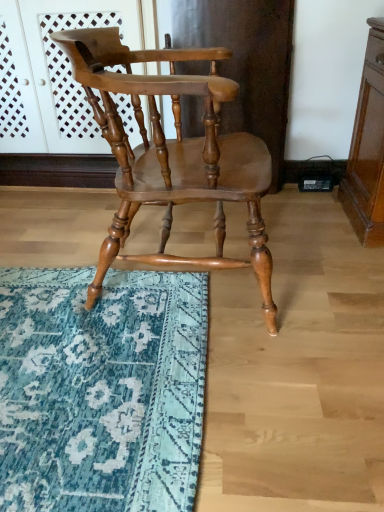
The image size is (384, 512). What do you see at coordinates (173, 153) in the screenshot?
I see `shiny brown wood chair at center` at bounding box center [173, 153].

Locate an element on the screen. Image resolution: width=384 pixels, height=512 pixels. shiny brown wood chair at center is located at coordinates (173, 153).

Is matte wood screen door at upper center surrounded by teal rug at lower left?

Definitely not — matte wood screen door at upper center is not inside teal rug at lower left.

Measure the distance from teal rug at lower left to matte wood screen door at upper center.

They are 3.89 feet apart.

Considering the sizes of teal rug at lower left and matte wood screen door at upper center in the image, is teal rug at lower left taller or shorter than matte wood screen door at upper center?

In the image, teal rug at lower left appears to be shorter than matte wood screen door at upper center.

From the image's perspective, is teal rug at lower left over shiny brown wood chair at center?

No, from the image's perspective, teal rug at lower left is not over shiny brown wood chair at center.

Would you say teal rug at lower left is to the left or to the right of shiny brown wood chair at center in the picture?

Clearly, teal rug at lower left is on the left of shiny brown wood chair at center in the image.

Between teal rug at lower left and shiny brown wood chair at center, which one has smaller size?

Smaller between the two is teal rug at lower left.

Considering the sizes of objects teal rug at lower left and shiny brown wood chair at center in the image provided, who is shorter, teal rug at lower left or shiny brown wood chair at center?

Standing shorter between the two is teal rug at lower left.

Which object is further away from the camera taking this photo, shiny brown wood chair at center or teal rug at lower left?

teal rug at lower left.

Are shiny brown wood chair at center and teal rug at lower left making contact?

No, shiny brown wood chair at center is not touching teal rug at lower left.

From a real-world perspective, is shiny brown wood chair at center positioned under teal rug at lower left based on gravity?

No.

How many degrees apart are the facing directions of shiny brown wood chair at center and teal rug at lower left?

179 degrees separate the facing orientations of shiny brown wood chair at center and teal rug at lower left.

From a real-world perspective, is matte wood screen door at upper center located beneath teal rug at lower left?

No, from a real-world perspective, matte wood screen door at upper center is not beneath teal rug at lower left.

Locate an element on the screen. The image size is (384, 512). screen door that appears above the teal rug at lower left (from the image's perspective) is located at coordinates (52, 73).

Who is shorter, matte wood screen door at upper center or teal rug at lower left?

With less height is teal rug at lower left.

Which is more distant, (50, 136) or (206, 185)?

Positioned behind is point (50, 136).

Identify the location of chair located underneath the matte wood screen door at upper center (from a real-world perspective). The width and height of the screenshot is (384, 512). (173, 153).

Are matte wood screen door at upper center and shiny brown wood chair at center far apart?

No, there isn't a large distance between matte wood screen door at upper center and shiny brown wood chair at center.

Is matte wood screen door at upper center oriented towards shiny brown wood chair at center?

Yes, matte wood screen door at upper center is aimed at shiny brown wood chair at center.

Are shiny brown wood chair at center and matte wood screen door at upper center far apart?

No, shiny brown wood chair at center is not far away from matte wood screen door at upper center.

Measure the distance from shiny brown wood chair at center to matte wood screen door at upper center.

shiny brown wood chair at center is 32.58 inches away from matte wood screen door at upper center.

From a real-world perspective, between shiny brown wood chair at center and matte wood screen door at upper center, who is vertically higher?

matte wood screen door at upper center is physically above.

From the image's perspective, is shiny brown wood chair at center located above or below matte wood screen door at upper center?

From the image's perspective, shiny brown wood chair at center appears below matte wood screen door at upper center.

Where is `screen door on the left of teal rug at lower left`? Image resolution: width=384 pixels, height=512 pixels. screen door on the left of teal rug at lower left is located at coordinates (52, 73).

Locate an element on the screen. chair to the right of teal rug at lower left is located at coordinates (173, 153).

In the scene shown: When comparing their distances from matte wood screen door at upper center, does teal rug at lower left or shiny brown wood chair at center seem closer?

The object closer to matte wood screen door at upper center is shiny brown wood chair at center.

When comparing their distances from shiny brown wood chair at center, does matte wood screen door at upper center or teal rug at lower left seem closer?

teal rug at lower left lies closer to shiny brown wood chair at center than the other object.

Looking at the image, which one is located further to teal rug at lower left, matte wood screen door at upper center or shiny brown wood chair at center?

The object further to teal rug at lower left is matte wood screen door at upper center.

Based on the photo, considering their positions, is shiny brown wood chair at center positioned further to matte wood screen door at upper center than teal rug at lower left?

Among the two, teal rug at lower left is located further to matte wood screen door at upper center.

From the image, which object appears to be nearer to shiny brown wood chair at center, teal rug at lower left or matte wood screen door at upper center?

teal rug at lower left.

Based on their spatial positions, is shiny brown wood chair at center or matte wood screen door at upper center further from teal rug at lower left?

matte wood screen door at upper center is further to teal rug at lower left.

This screenshot has height=512, width=384. I want to click on mat between shiny brown wood chair at center and matte wood screen door at upper center along the z-axis, so click(x=101, y=390).